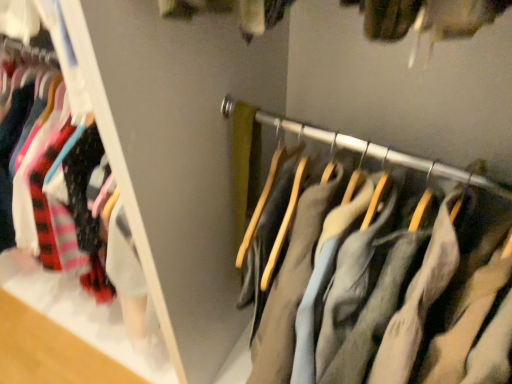
Question: In the image, is matte black hangers at left positioned in front of or behind light gray cotton pants at center?

Choices:
 (A) front
 (B) behind

Answer: (B)

Question: In terms of width, does matte black hangers at left look wider or thinner when compared to light gray cotton pants at center?

Choices:
 (A) thin
 (B) wide

Answer: (A)

Question: From their relative heights in the image, would you say matte black hangers at left is taller or shorter than light gray cotton pants at center?

Choices:
 (A) tall
 (B) short

Answer: (A)

Question: Is light gray cotton pants at center in front of or behind matte black hangers at left in the image?

Choices:
 (A) front
 (B) behind

Answer: (A)

Question: Based on their positions, is light gray cotton pants at center located to the left or right of matte black hangers at left?

Choices:
 (A) right
 (B) left

Answer: (A)

Question: In terms of height, does light gray cotton pants at center look taller or shorter compared to matte black hangers at left?

Choices:
 (A) short
 (B) tall

Answer: (A)

Question: From a real-world perspective, is light gray cotton pants at center positioned above or below matte black hangers at left?

Choices:
 (A) above
 (B) below

Answer: (B)